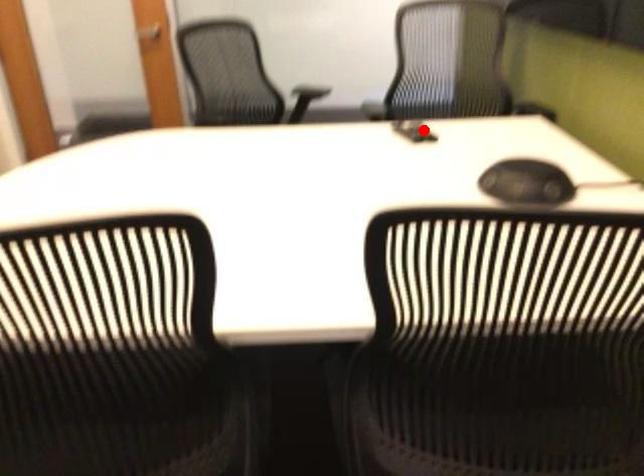
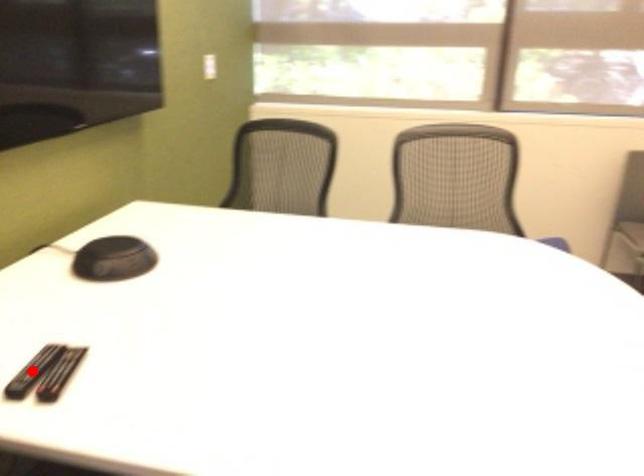
I am providing you with two images of the same scene from different viewpoints. A red point is marked on the first image and another point is marked on the second image. Do the highlighted points in image1 and image2 indicate the same real-world spot?

Yes